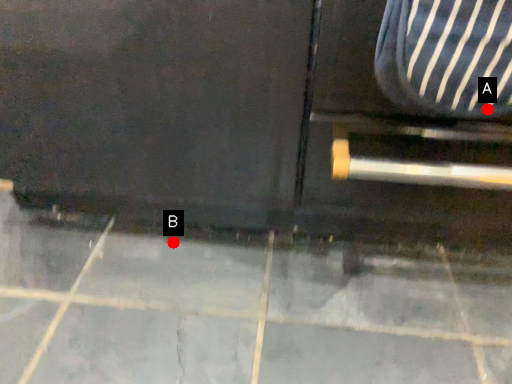
Question: Two points are circled on the image, labeled by A and B beside each circle. Which point appears closest to the camera in this image?

Choices:
 (A) A is closer
 (B) B is closer

Answer: (A)